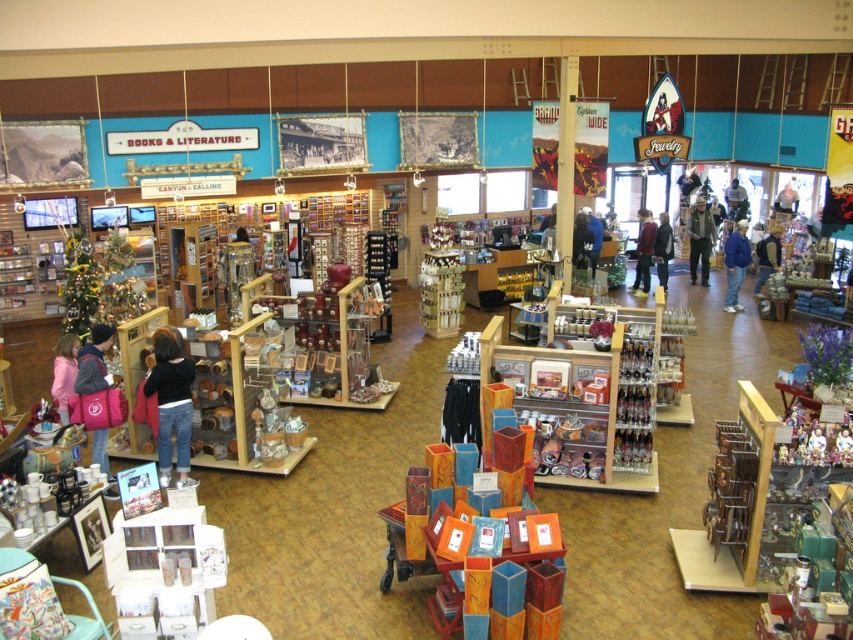
Is blue denim jeans at center bigger than black leather jacket at center?

Yes, blue denim jeans at center is bigger than black leather jacket at center.

Find the location of a particular element. The width and height of the screenshot is (853, 640). blue denim jeans at center is located at coordinates click(735, 264).

Is jeans at center to the left of blue denim jeans at center from the viewer's perspective?

Indeed, jeans at center is positioned on the left side of blue denim jeans at center.

Between jeans at center and blue denim jeans at center, which one has more height?

With more height is blue denim jeans at center.

Does point (173, 400) lie behind point (733, 252)?

No, it is not.

This screenshot has height=640, width=853. Identify the location of jeans at center. (171, 404).

Is point (94, 344) in front of point (670, 246)?

That is True.

Which is below, pink fabric bag at left or dark blue jacket at center?

pink fabric bag at left

The image size is (853, 640). Describe the element at coordinates (94, 362) in the screenshot. I see `pink fabric bag at left` at that location.

At what (x,y) coordinates should I click in order to perform the action: click on pink fabric bag at left. Please return your answer as a coordinate pair (x, y). Looking at the image, I should click on (94, 362).